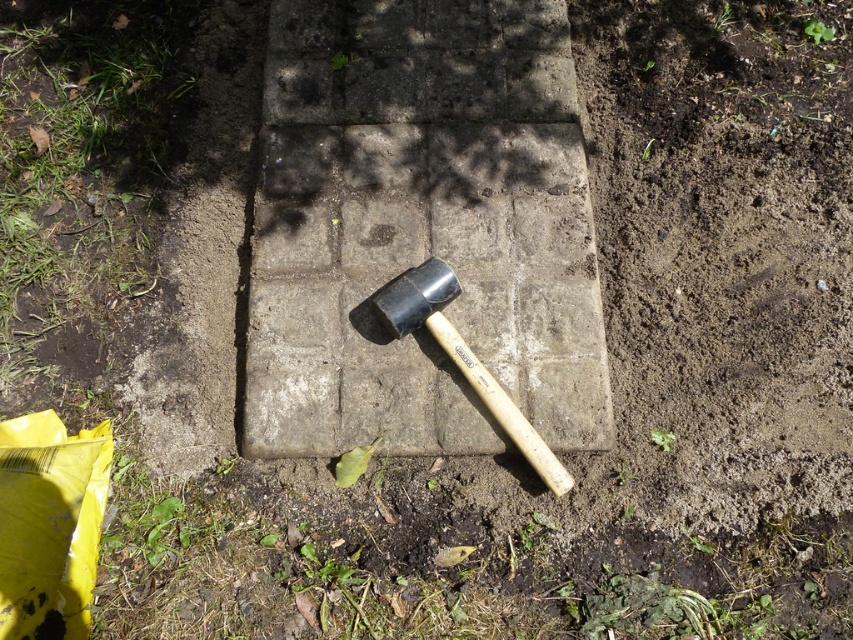
Question: Which point appears closest to the camera in this image?

Choices:
 (A) (437, 307)
 (B) (465, 250)
 (C) (70, 52)

Answer: (A)

Question: Which point appears closest to the camera in this image?

Choices:
 (A) (567, 355)
 (B) (540, 465)
 (C) (16, 227)

Answer: (B)

Question: Can you confirm if green grass at lower left is positioned below black rubber hammer at center?

Choices:
 (A) no
 (B) yes

Answer: (A)

Question: Estimate the real-world distances between objects in this image. Which object is closer to the green grass at lower left?

Choices:
 (A) black rubber hammer at center
 (B) gray concrete at center

Answer: (B)

Question: Where is green grass at lower left located in relation to black rubber hammer at center in the image?

Choices:
 (A) left
 (B) right

Answer: (A)

Question: Does gray concrete at center lie behind black rubber hammer at center?

Choices:
 (A) no
 (B) yes

Answer: (B)